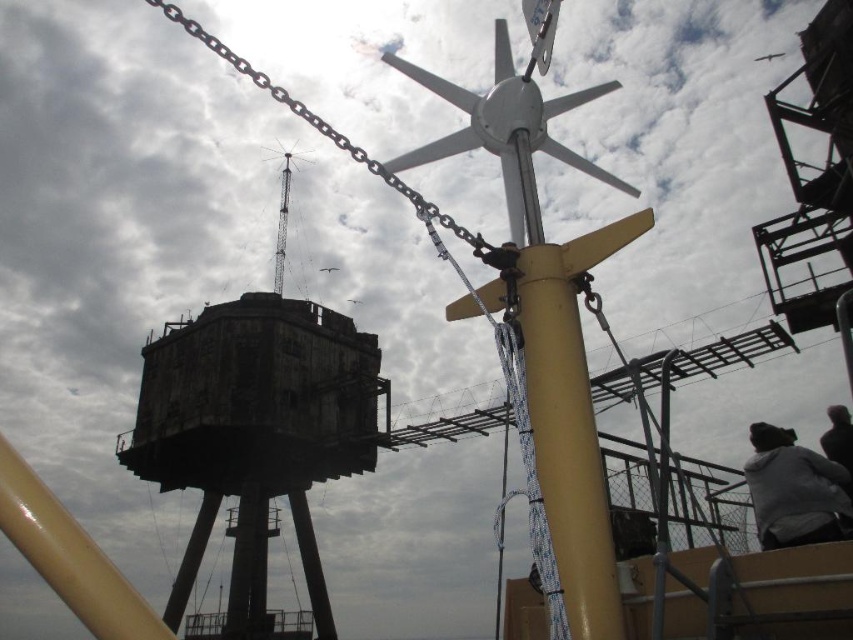
Locate an element on the screen. The width and height of the screenshot is (853, 640). dark gray concrete tower at center is located at coordinates (254, 433).

Who is positioned more to the right, dark gray concrete tower at center or dark gray hair at lower right?

From the viewer's perspective, dark gray hair at lower right appears more on the right side.

Between point (210, 440) and point (840, 464), which one is positioned in front?

Point (840, 464) is in front.

You are a GUI agent. You are given a task and a screenshot of the screen. Output one action in this format:
    pyautogui.click(x=<x>, y=<y>)
    Task: Click on the dark gray concrete tower at center
    The image size is (853, 640).
    Given the screenshot: What is the action you would take?
    pyautogui.click(x=254, y=433)

Between dark gray concrete tower at center and gray fleece jacket at lower right, which one appears on the left side from the viewer's perspective?

dark gray concrete tower at center is more to the left.

Find the location of a particular element. dark gray concrete tower at center is located at coordinates (254, 433).

Does point (804, 467) lie in front of point (836, 416)?

Yes, it is in front of point (836, 416).

Which is above, gray fleece jacket at lower right or dark gray hair at lower right?

gray fleece jacket at lower right is higher up.

Who is more distant from viewer, (820,476) or (831,460)?

The point (831,460) is more distant.

The width and height of the screenshot is (853, 640). What are the coordinates of `gray fleece jacket at lower right` in the screenshot? It's located at (793, 490).